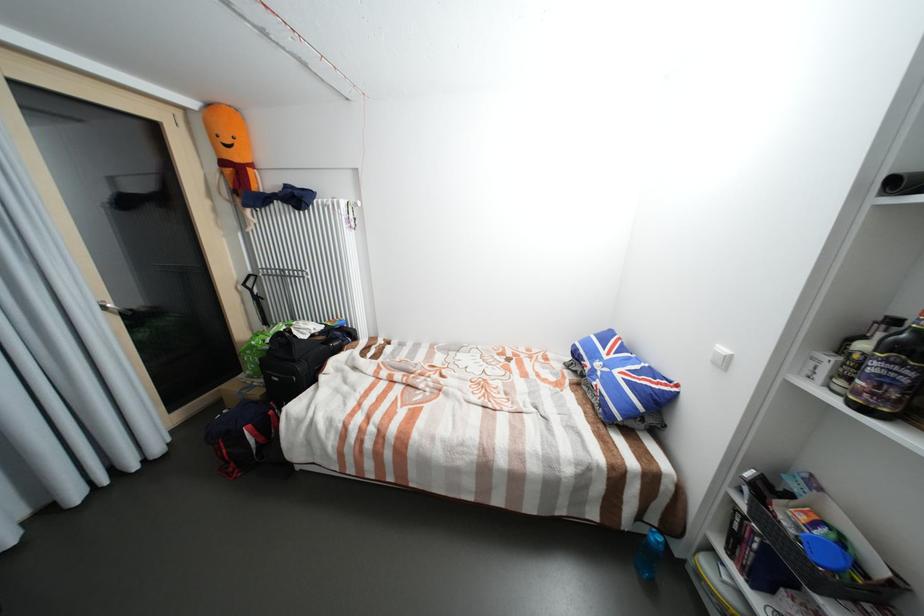
Find the location of a particular element. This screenshot has height=616, width=924. white light switch is located at coordinates (721, 357).